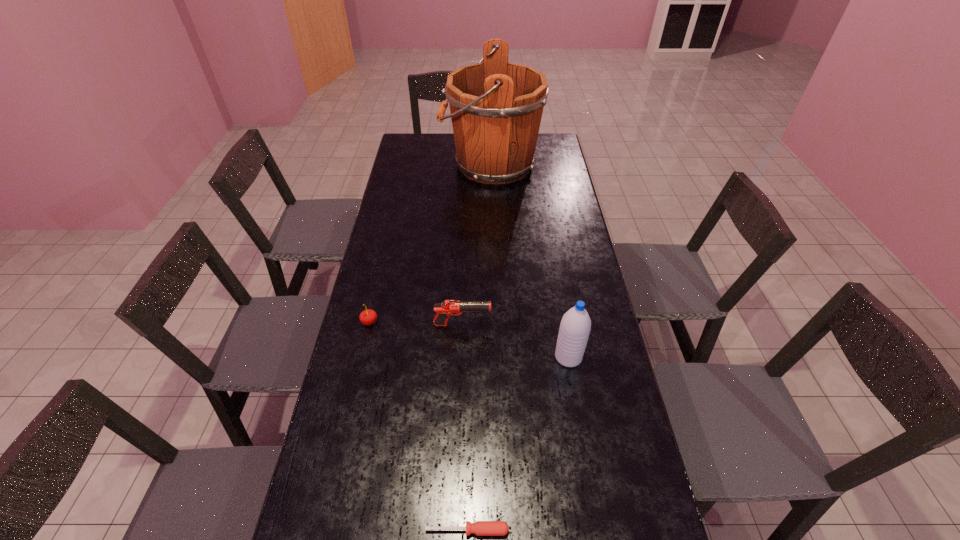
Where is `free space located with the handle on the side of the tallest object`? This screenshot has width=960, height=540. free space located with the handle on the side of the tallest object is located at coordinates (407, 165).

The width and height of the screenshot is (960, 540). I want to click on vacant area situated 0.190m with the handle on the side of the tallest object, so click(398, 165).

In order to click on vacant space located 0.200m on the front of the second nearest object in this screenshot , I will do `click(582, 439)`.

Where is `blank space located at the aiming end of the gun`? This screenshot has height=540, width=960. blank space located at the aiming end of the gun is located at coordinates (601, 325).

Locate an element on the screen. vacant space located on the right of the leftmost object is located at coordinates (401, 322).

Find the location of a particular element. The height and width of the screenshot is (540, 960). vacant space located on the right of the nearest object is located at coordinates (546, 530).

The width and height of the screenshot is (960, 540). Identify the location of object located in the far edge section of the desktop. pos(496,107).

Where is `object located at the left edge`? The height and width of the screenshot is (540, 960). object located at the left edge is located at coordinates (367, 317).

Where is `bucket that is at the right edge`? bucket that is at the right edge is located at coordinates (496, 107).

Image resolution: width=960 pixels, height=540 pixels. Identify the location of water bottle situated at the right edge. (575, 326).